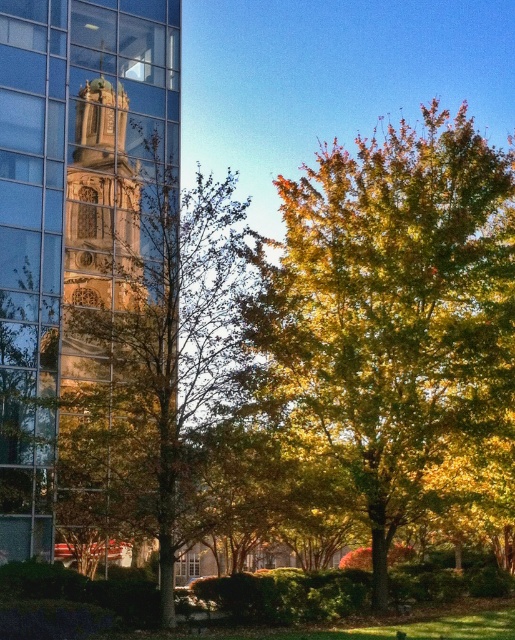
You are an architect analyzing the layout of the scene. Based on the positioning of the golden glass tower at left and the green leafy tree at center, which object would cast a shadow over the other during midday when the sun is directly overhead?

The golden glass tower at left is located above the green leafy tree at center, so its shadow would fall over the green leafy tree at center during midday when the sun is directly overhead.